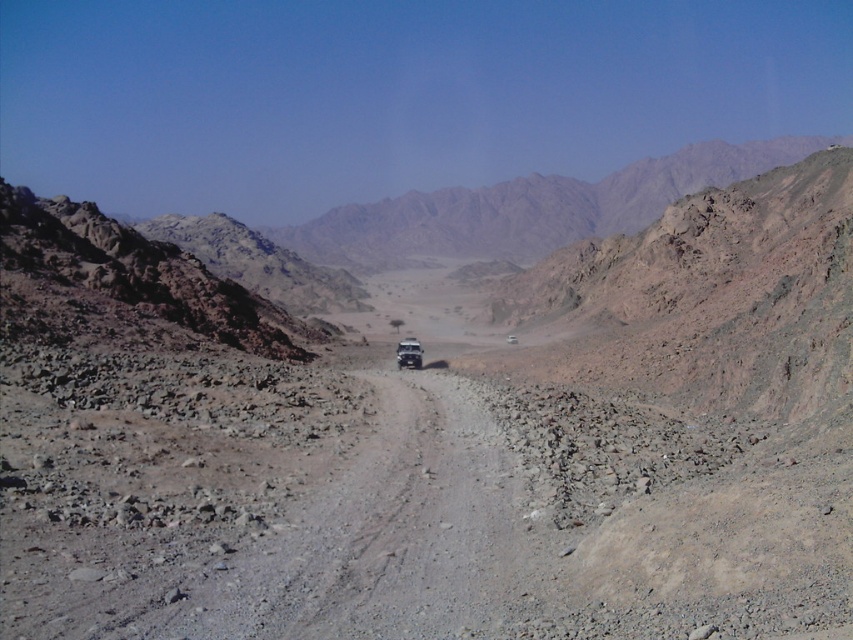
Question: Is rugged brown mountain at center closer to camera compared to metallic silver suv at center?

Choices:
 (A) yes
 (B) no

Answer: (B)

Question: Which point appears farthest from the camera in this image?

Choices:
 (A) (496, 227)
 (B) (396, 358)

Answer: (A)

Question: Which object is closer to the camera taking this photo?

Choices:
 (A) metallic silver suv at center
 (B) rugged brown mountain at center

Answer: (A)

Question: Is rugged brown mountain at center to the left of metallic silver suv at center from the viewer's perspective?

Choices:
 (A) no
 (B) yes

Answer: (A)

Question: Considering the relative positions of rugged brown mountain at center and metallic silver suv at center in the image provided, where is rugged brown mountain at center located with respect to metallic silver suv at center?

Choices:
 (A) right
 (B) left

Answer: (A)